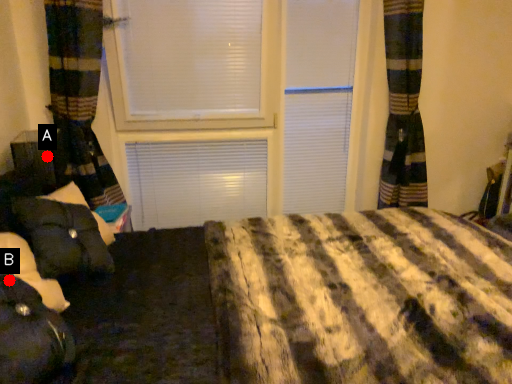
Question: Two points are circled on the image, labeled by A and B beside each circle. Which point is closer to the camera?

Choices:
 (A) A is closer
 (B) B is closer

Answer: (B)